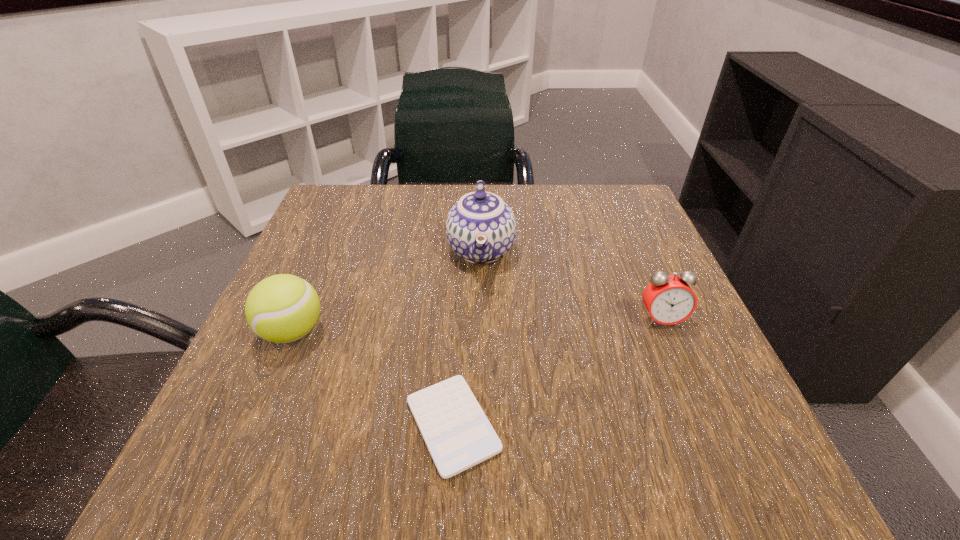
Locate an element on the screen. This screenshot has width=960, height=540. object that is at the far edge is located at coordinates (481, 228).

You are a GUI agent. You are given a task and a screenshot of the screen. Output one action in this format:
    pyautogui.click(x=<x>, y=<y>)
    Task: Click on the object that is at the near edge
    This screenshot has width=960, height=540.
    Given the screenshot: What is the action you would take?
    pyautogui.click(x=458, y=435)

The height and width of the screenshot is (540, 960). I want to click on object that is at the left edge, so click(x=283, y=308).

The height and width of the screenshot is (540, 960). Identify the location of object that is at the right edge. tap(669, 299).

The image size is (960, 540). What are the coordinates of `vacant space at the far edge of the desktop` in the screenshot? It's located at (417, 236).

Find the location of a particular element. The height and width of the screenshot is (540, 960). vacant space at the near edge of the desktop is located at coordinates [x=396, y=443].

Locate an element on the screen. The image size is (960, 540). free region at the left edge of the desktop is located at coordinates (296, 373).

At what (x,y) coordinates should I click in order to perform the action: click on vacant area at the right edge. Please return your answer as a coordinate pair (x, y). Looking at the image, I should click on (612, 268).

Locate an element on the screen. This screenshot has width=960, height=540. free space at the far left corner of the desktop is located at coordinates (386, 194).

You are a GUI agent. You are given a task and a screenshot of the screen. Output one action in this format:
    pyautogui.click(x=<x>, y=<y>)
    Task: Click on the vacant region at the near left corner of the desktop
    The height and width of the screenshot is (540, 960).
    Given the screenshot: What is the action you would take?
    pyautogui.click(x=213, y=453)